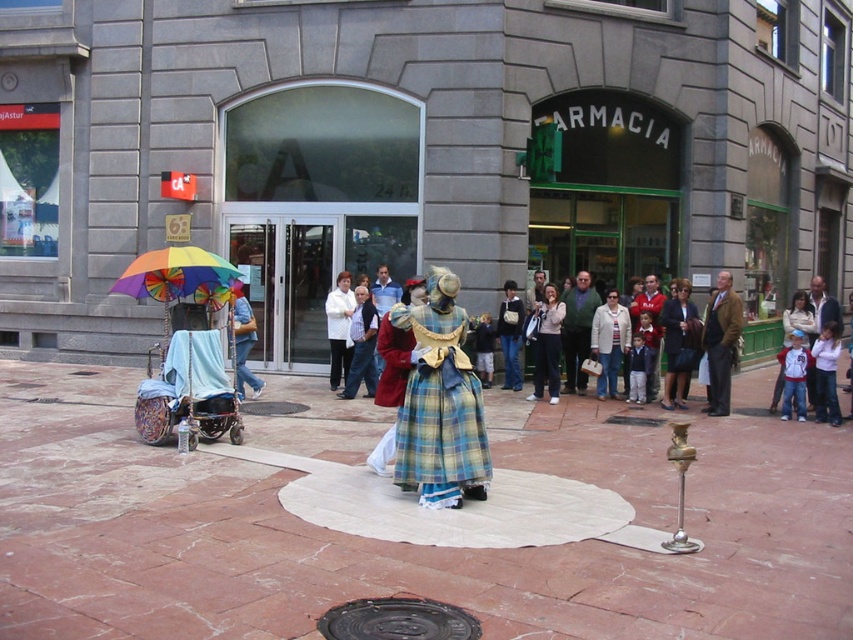
Which of these two, plaid fabric dress at center or matte pink sweater at center, stands shorter?

Standing shorter between the two is matte pink sweater at center.

Image resolution: width=853 pixels, height=640 pixels. What are the coordinates of `plaid fabric dress at center` in the screenshot? It's located at (440, 403).

Can you confirm if black rubber manhole cover at center is positioned above matte pink sweater at center?

Incorrect, black rubber manhole cover at center is not positioned above matte pink sweater at center.

Who is positioned more to the right, black rubber manhole cover at center or matte pink sweater at center?

matte pink sweater at center

Locate an element on the screen. The height and width of the screenshot is (640, 853). black rubber manhole cover at center is located at coordinates (397, 620).

Can you confirm if smooth brick pavement at center is bigger than plaid fabric dress at center?

Yes, smooth brick pavement at center is bigger than plaid fabric dress at center.

You are a GUI agent. You are given a task and a screenshot of the screen. Output one action in this format:
    pyautogui.click(x=<x>, y=<y>)
    Task: Click on the smooth brick pavement at center
    
    Given the screenshot: What is the action you would take?
    pyautogui.click(x=387, y=541)

Between point (134, 540) and point (433, 387), which one is positioned in front?

Point (134, 540) is in front.

The height and width of the screenshot is (640, 853). Identify the location of smooth brick pavement at center. pos(387,541).